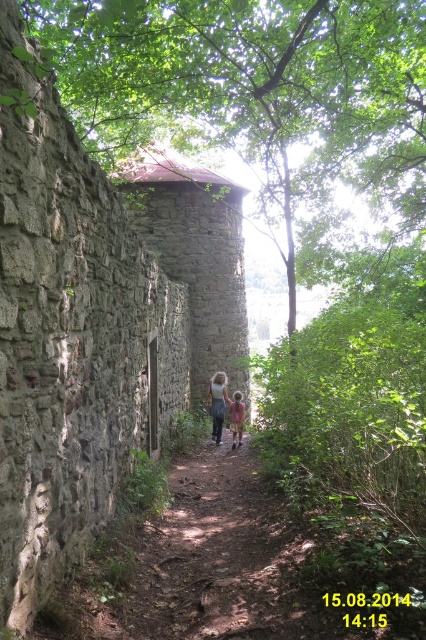
You are a fashion designer observing a model wearing a denim skirt at center and a light pink cotton shirt at center. Which clothing item is wider?

The denim skirt at center is wider than the light pink cotton shirt at center.

You are a hiker who has lost their backpack. You see a denim skirt at center and a light pink cotton shirt at center on the ground. Which item should you pick up first if you want to carry both but have limited space?

The denim skirt at center is bigger than light pink cotton shirt at center, so you should pick up the light pink cotton shirt at center first to save space for the larger denim skirt at center.

You are standing on the pathway in the forest scene and see two points marked on the ground ahead of you. The first point is at coordinates point (218, 387) and the second is at point (235, 436). Which point is closer to you?

Point (235, 436) is closer to you because it is less further to the camera than point (218, 387).